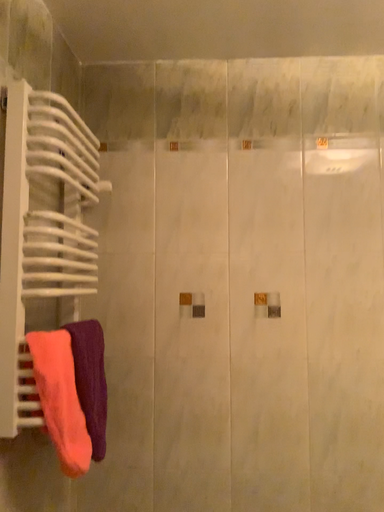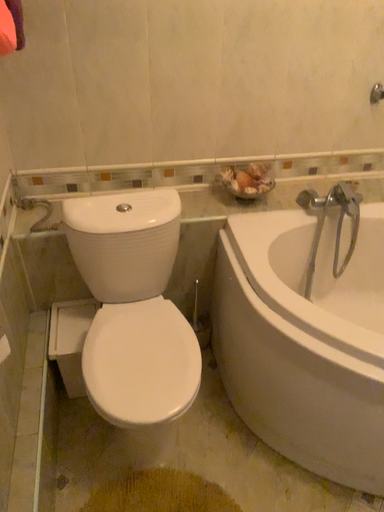
Question: How did the camera likely rotate when shooting the video?

Choices:
 (A) rotated left
 (B) rotated right

Answer: (B)